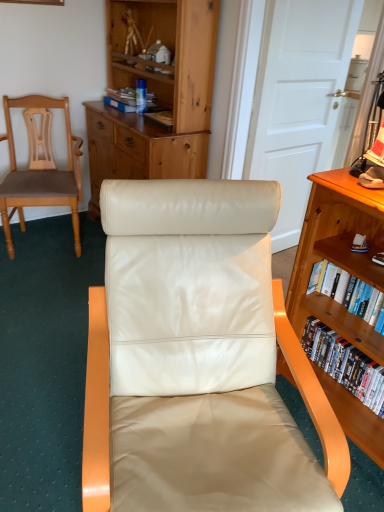
Question: From the image's perspective, is white wood door at upper center above or below matte cardboard book at upper center, the 3th book when ordered from right to left?

Choices:
 (A) below
 (B) above

Answer: (A)

Question: Relative to matte cardboard book at upper center, positioned as the first book in back-to-front order, is white wood door at upper center in front or behind?

Choices:
 (A) front
 (B) behind

Answer: (A)

Question: Which object is the closest to the metallic silver lamp at upper right?

Choices:
 (A) white glossy bookshelf at right, which appears as the 3th book when viewed from the top
 (B) satin white leather chair at center, the 1th chair in the front-to-back sequence
 (C) wooden bookshelf at right
 (D) matte cardboard book at upper center, positioned as the first book in top-to-bottom order
 (E) white wood door at upper center

Answer: (C)

Question: Which is nearer to the matte cardboard book at upper center, positioned as the first book in back-to-front order?

Choices:
 (A) metallic silver lamp at upper right
 (B) wooden bookshelf at right
 (C) matte brown wood chair at left, the second chair viewed from the right
 (D) white glossy bookshelf at right, arranged as the 2th book when viewed from the front
 (E) hardcover book at right, which appears as the 1th book when viewed from the front

Answer: (C)